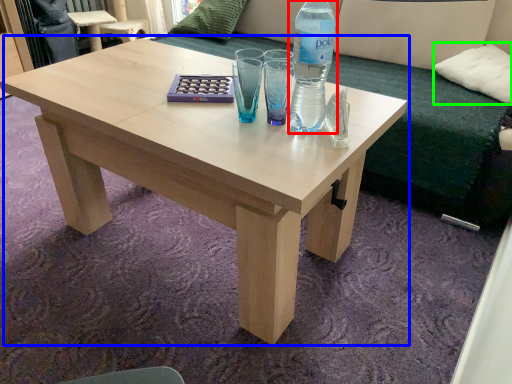
Question: Which object is positioned closest to bottle (highlighted by a red box)? Select from coffee table (highlighted by a blue box) and pillow (highlighted by a green box).

Choices:
 (A) coffee table
 (B) pillow

Answer: (A)